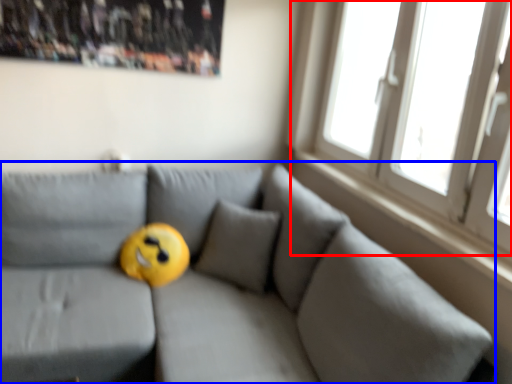
Question: Which point is further to the camera, window (highlighted by a red box) or studio couch (highlighted by a blue box)?

Choices:
 (A) window
 (B) studio couch

Answer: (A)